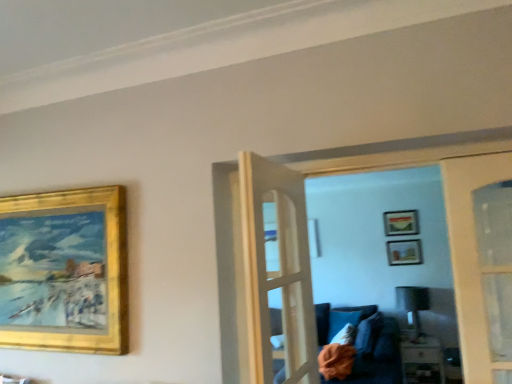
Question: Visually, is matte gold picture frame at upper center, positioned as the second picture frame in left-to-right order, positioned to the left or to the right of matte black lamp at center?

Choices:
 (A) right
 (B) left

Answer: (A)

Question: Considering the positions of matte gold picture frame at upper center, positioned as the second picture frame in left-to-right order, and matte black lamp at center in the image, is matte gold picture frame at upper center, positioned as the second picture frame in left-to-right order, taller or shorter than matte black lamp at center?

Choices:
 (A) short
 (B) tall

Answer: (A)

Question: Considering the real-world distances, which object is closest to the wooden table at lower right?

Choices:
 (A) matte black lamp at center
 (B) matte gold picture frame at upper center, positioned as the second picture frame in left-to-right order
 (C) matte gold picture frame at upper center, which ranks as the second picture frame in back-to-front order
 (D) gold/gilded picture frame at upper left, marked as the 3th picture frame in a back-to-front arrangement
 (E) white fabric pillow at lower center

Answer: (A)

Question: Which is nearer to the matte black lamp at center?

Choices:
 (A) matte gold picture frame at upper center, the second picture frame in the front-to-back sequence
 (B) white fabric pillow at lower center
 (C) matte gold picture frame at upper center, acting as the first picture frame starting from the back
 (D) gold/gilded picture frame at upper left, the third picture frame in the right-to-left sequence
 (E) wooden table at lower right

Answer: (A)